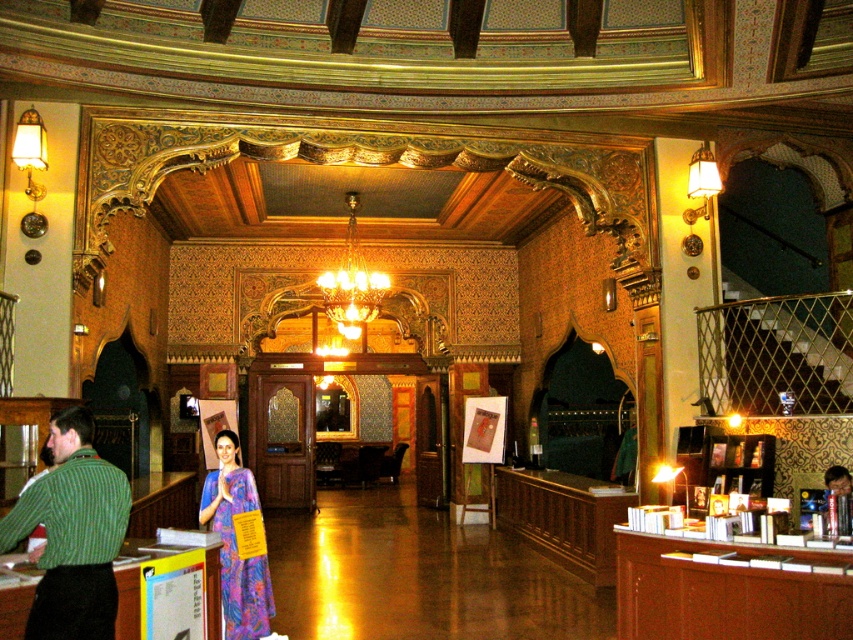
Question: Estimate the real-world distances between objects in this image. Which object is farther from the vivid purple silk sari at center?

Choices:
 (A) green knitted sweater at lower left
 (B) brown wood/finish information desk at lower right

Answer: (B)

Question: Is brown wood/finish information desk at lower right smaller than crystal glass chandelier at center?

Choices:
 (A) no
 (B) yes

Answer: (A)

Question: Which is farther from the crystal glass chandelier at center?

Choices:
 (A) brown wood/finish information desk at lower right
 (B) vivid purple silk sari at center
 (C) green knitted sweater at lower left

Answer: (C)

Question: Among these objects, which one is nearest to the camera?

Choices:
 (A) crystal glass chandelier at center
 (B) green knitted sweater at lower left
 (C) vivid purple silk sari at center

Answer: (B)

Question: Can you confirm if vivid purple silk sari at center is wider than crystal glass chandelier at center?

Choices:
 (A) no
 (B) yes

Answer: (A)

Question: Where is green knitted sweater at lower left located in relation to crystal glass chandelier at center in the image?

Choices:
 (A) below
 (B) above

Answer: (A)